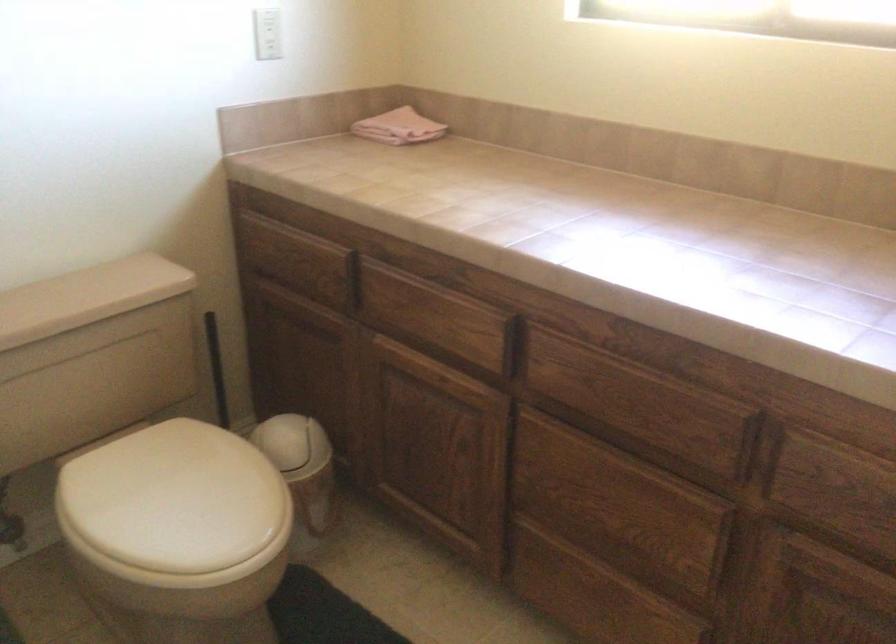
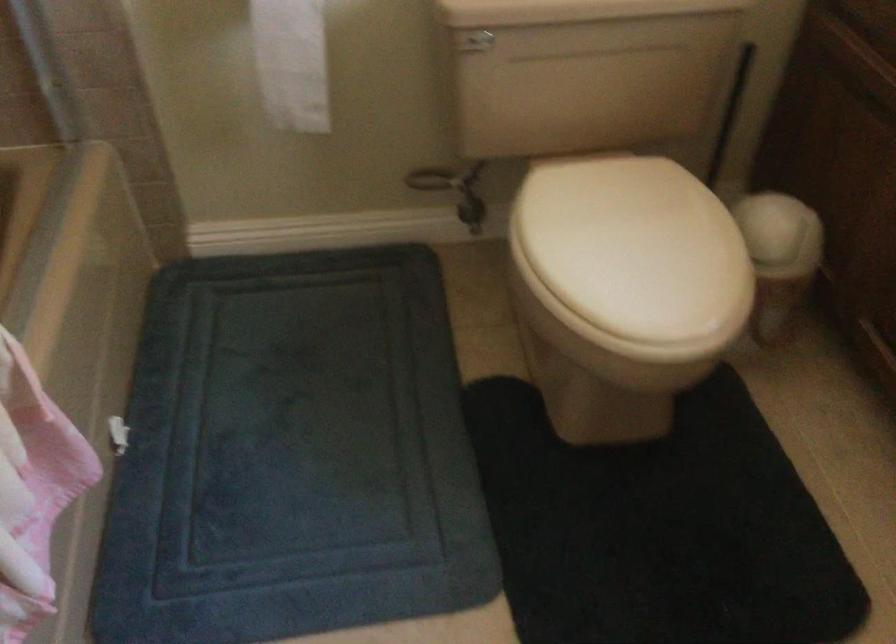
Where in the second image is the point corresponding to [193,502] from the first image?

(634, 247)